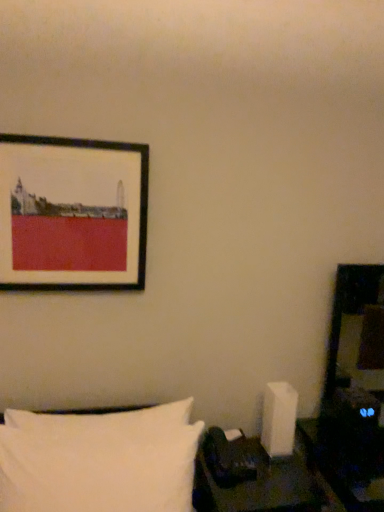
Question: Is black leather table at lower right bigger than white soft pillow at lower left?

Choices:
 (A) yes
 (B) no

Answer: (B)

Question: Considering the relative positions of black leather table at lower right and white soft pillow at lower left in the image provided, is black leather table at lower right to the left of white soft pillow at lower left from the viewer's perspective?

Choices:
 (A) yes
 (B) no

Answer: (B)

Question: Considering the relative sizes of black leather table at lower right and white soft pillow at lower left in the image provided, is black leather table at lower right taller than white soft pillow at lower left?

Choices:
 (A) no
 (B) yes

Answer: (A)

Question: Is white soft pillow at lower left at the back of black leather table at lower right?

Choices:
 (A) no
 (B) yes

Answer: (A)

Question: From a real-world perspective, is black leather table at lower right on top of white soft pillow at lower left?

Choices:
 (A) no
 (B) yes

Answer: (A)

Question: Visually, is black leather table at lower right positioned to the left or to the right of matte black picture frame at upper left?

Choices:
 (A) right
 (B) left

Answer: (A)

Question: Considering their positions, is black leather table at lower right located in front of or behind matte black picture frame at upper left?

Choices:
 (A) behind
 (B) front

Answer: (B)

Question: Is black leather table at lower right taller or shorter than matte black picture frame at upper left?

Choices:
 (A) tall
 (B) short

Answer: (B)

Question: From a real-world perspective, is black leather table at lower right physically located above or below matte black picture frame at upper left?

Choices:
 (A) above
 (B) below

Answer: (B)

Question: Is black leather table at lower right in front of or behind white soft pillow at lower left in the image?

Choices:
 (A) front
 (B) behind

Answer: (B)

Question: Is black leather table at lower right situated inside white soft pillow at lower left or outside?

Choices:
 (A) outside
 (B) inside

Answer: (A)

Question: In terms of width, does black leather table at lower right look wider or thinner when compared to white soft pillow at lower left?

Choices:
 (A) wide
 (B) thin

Answer: (A)

Question: Does point (289, 480) appear closer or farther from the camera than point (180, 452)?

Choices:
 (A) closer
 (B) farther

Answer: (B)

Question: Based on their positions, is matte black picture frame at upper left located to the left or right of black leather table at lower right?

Choices:
 (A) right
 (B) left

Answer: (B)

Question: In terms of size, does matte black picture frame at upper left appear bigger or smaller than black leather table at lower right?

Choices:
 (A) small
 (B) big

Answer: (A)